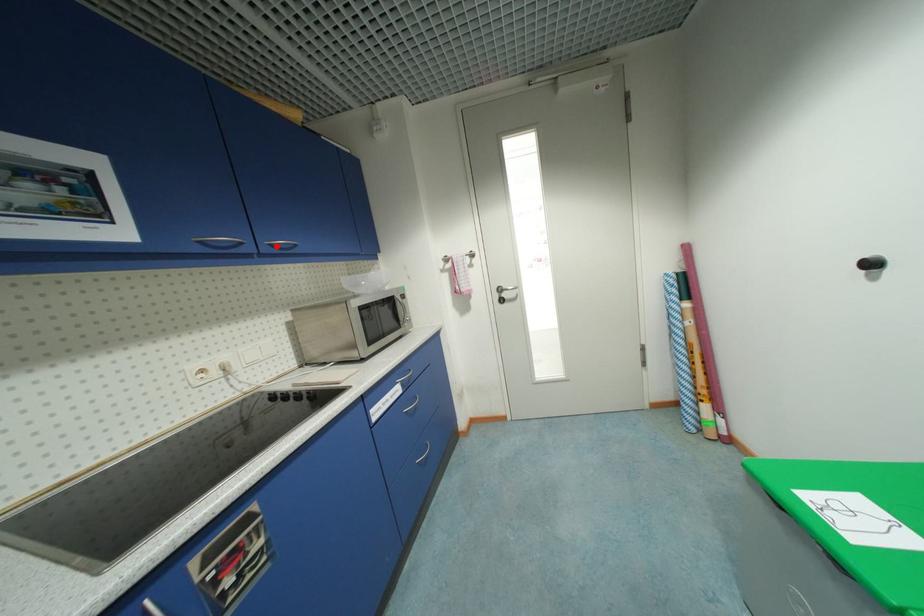
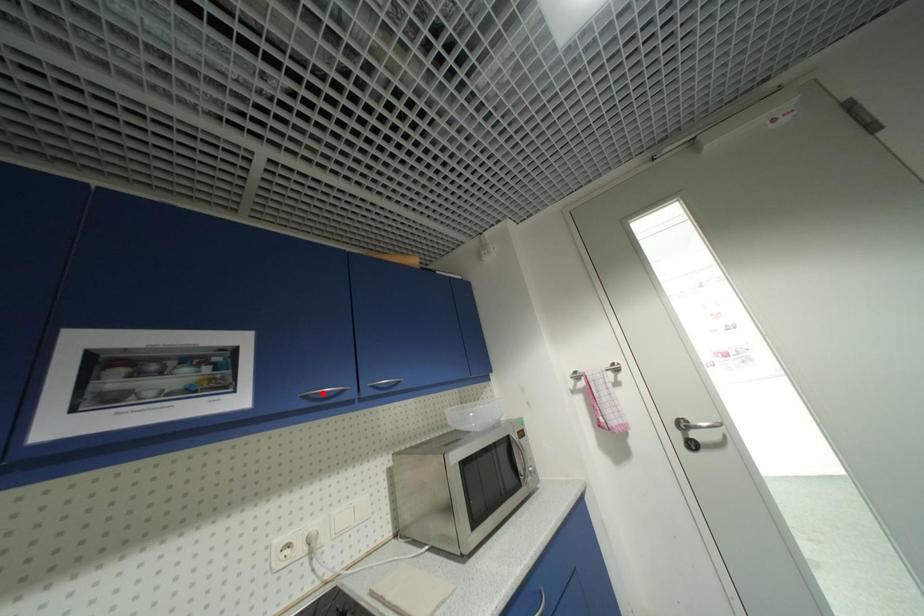
I am providing you with two images of the same scene from different viewpoints. A red point is marked on the first image and another point is marked on the second image. Is the red point in image1 aligned with the point shown in image2?

No